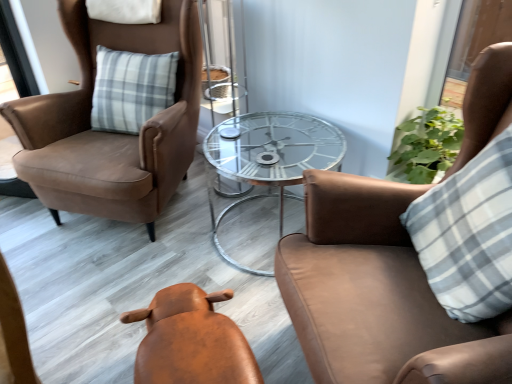
Question: Is transparent glass table at center bigger or smaller than suede brown armchair at left, marked as the first chair in a left-to-right arrangement?

Choices:
 (A) big
 (B) small

Answer: (B)

Question: Is point pos(252,122) positioned closer to the camera than point pos(166,36)?

Choices:
 (A) closer
 (B) farther

Answer: (A)

Question: Which object is positioned farthest from the suede brown armchair at left, marked as the first chair in a left-to-right arrangement?

Choices:
 (A) transparent glass table at center
 (B) leather stool at center, which appears as the 2th chair when viewed from the right
 (C) white checkered pillow at right
 (D) brown leather chair at upper right, which ranks as the first chair in right-to-left order

Answer: (C)

Question: Which object is positioned closest to the white checkered pillow at right?

Choices:
 (A) brown leather chair at upper right, which ranks as the first chair in right-to-left order
 (B) transparent glass table at center
 (C) suede brown armchair at left, marked as the first chair in a left-to-right arrangement
 (D) leather stool at center, which is counted as the second chair, starting from the left

Answer: (A)